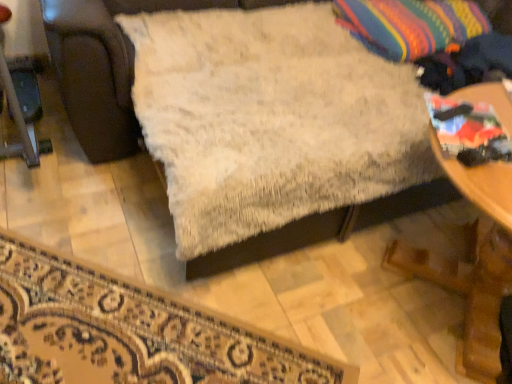
Identify the location of vacant space underneath white fluffy rug at lower center (from a real-world perspective). Image resolution: width=512 pixels, height=384 pixels. (110, 334).